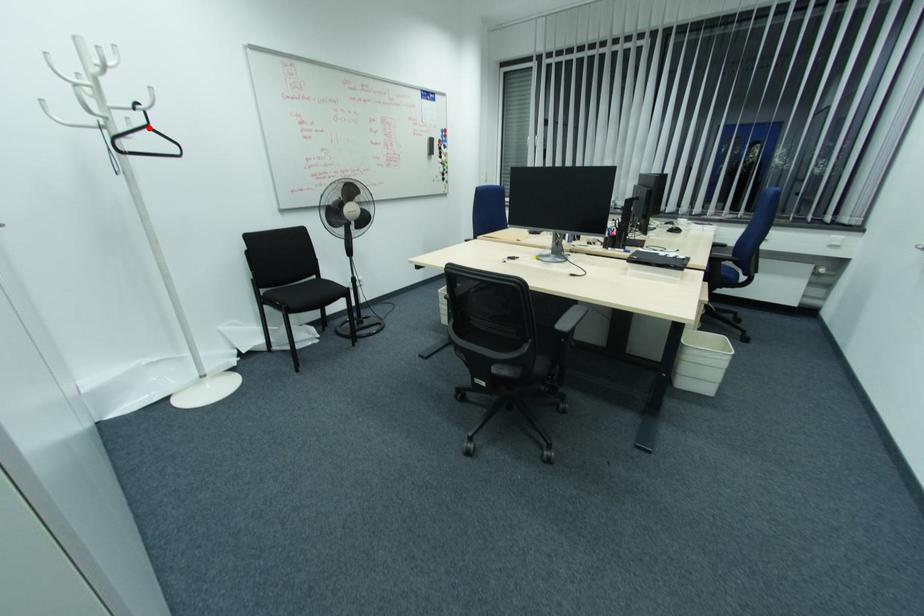
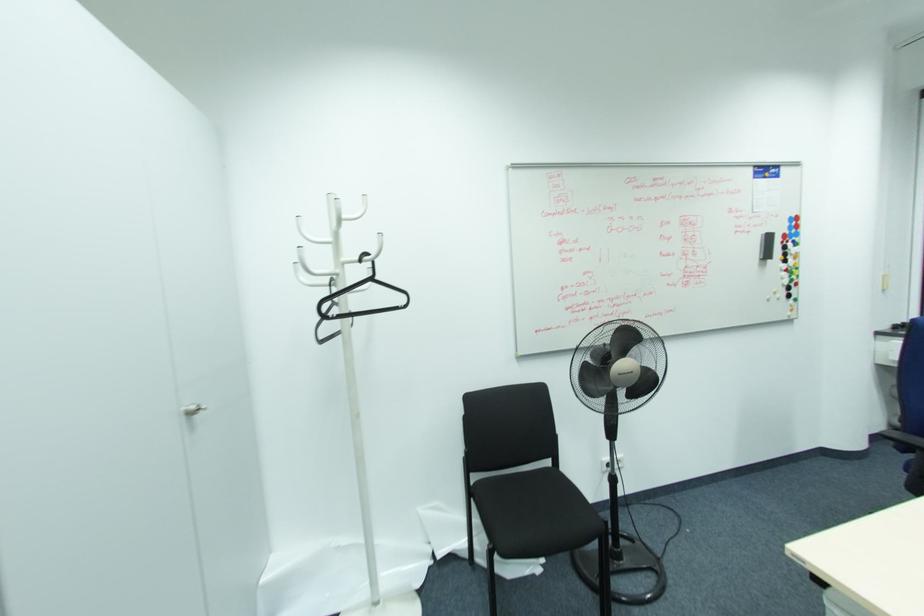
Find the pixel in the second image that matches the highlighted location in the first image.

(371, 280)